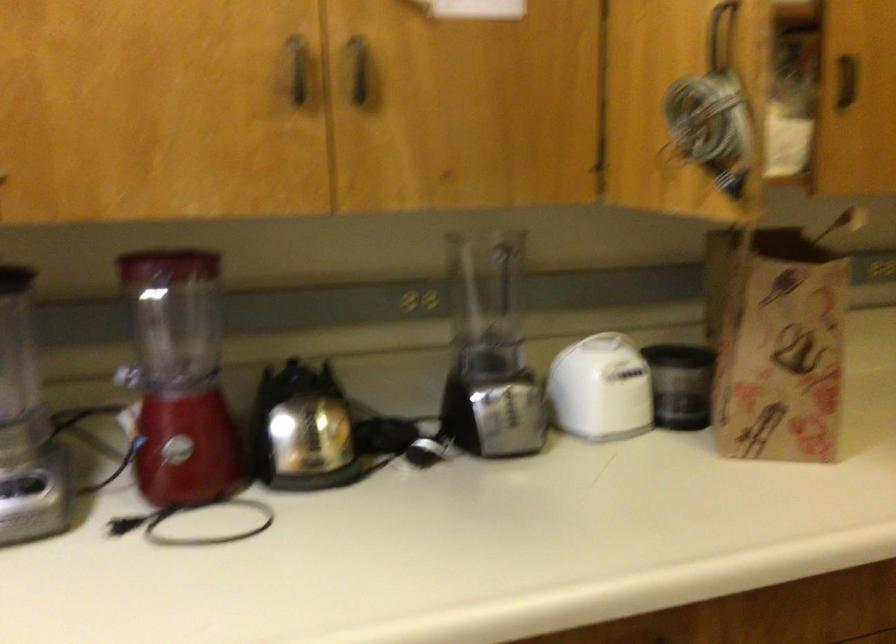
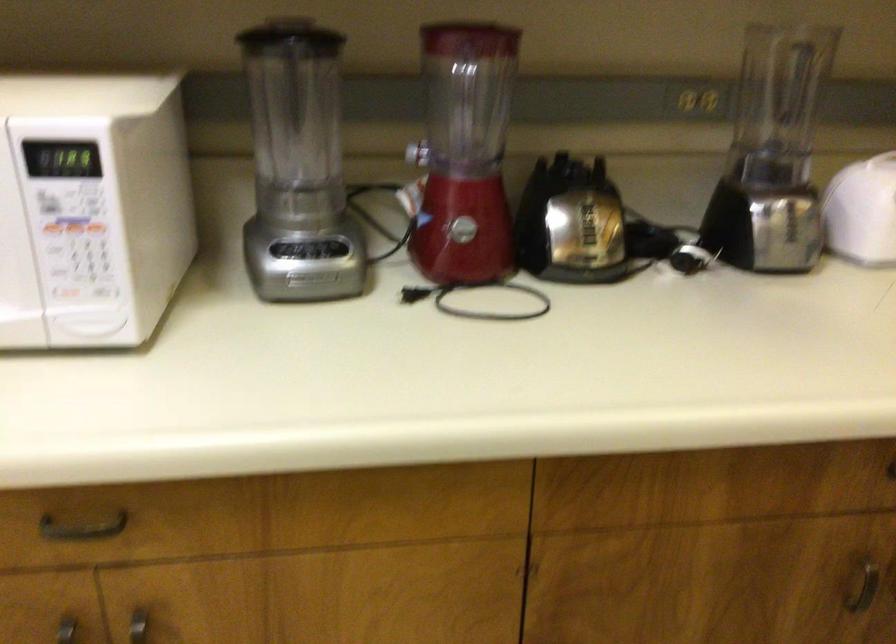
Find the pixel in the second image that matches point (303, 436) in the first image.

(580, 225)